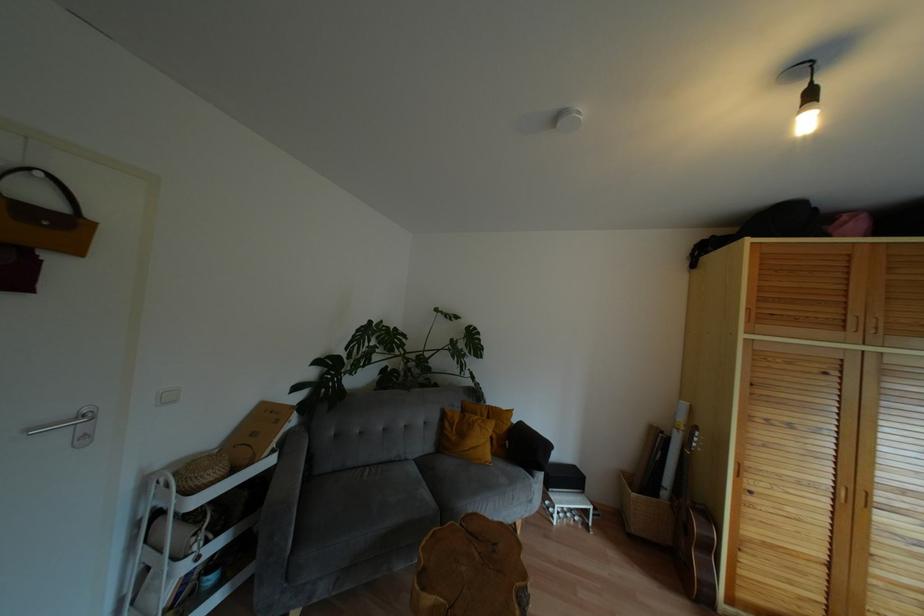
At what (x,y) coordinates should I click in order to perform the action: click on dark cushion. Please return your answer as a coordinate pair (x, y). The image size is (924, 616). Looking at the image, I should click on 527,447.